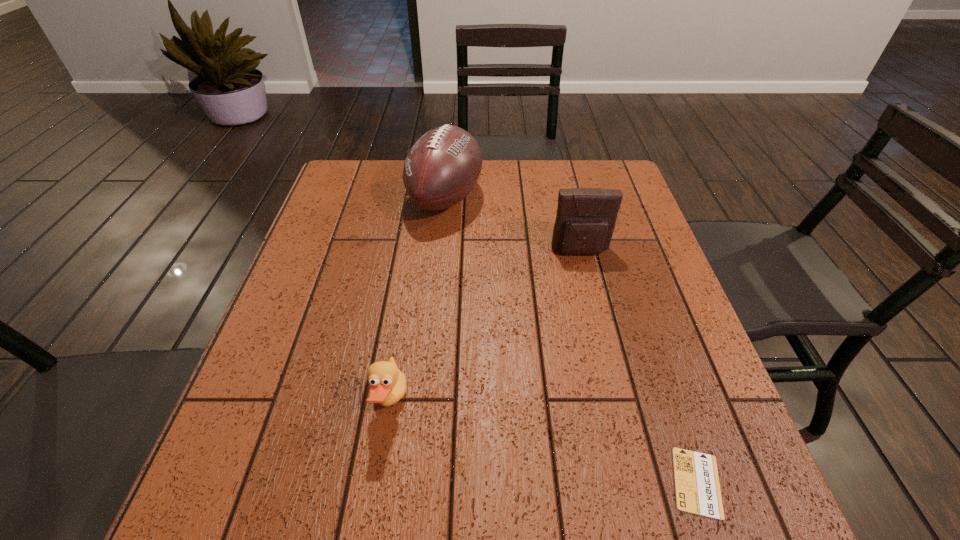
I want to click on football (American), so click(443, 166).

Where is `the tallest object`? The height and width of the screenshot is (540, 960). the tallest object is located at coordinates (443, 166).

Identify the location of pouch. (586, 217).

At what (x,y) coordinates should I click in order to perform the action: click on the third shortest object. Please return your answer as a coordinate pair (x, y). Looking at the image, I should click on (586, 217).

In order to click on the second shortest object in this screenshot , I will do `click(388, 384)`.

At what (x,y) coordinates should I click in order to perform the action: click on duck. Please return your answer as a coordinate pair (x, y). The height and width of the screenshot is (540, 960). Looking at the image, I should click on (388, 384).

The image size is (960, 540). What are the coordinates of `the shortest object` in the screenshot? It's located at pyautogui.click(x=697, y=486).

At what (x,y) coordinates should I click in order to perform the action: click on the nearest object. Please return your answer as a coordinate pair (x, y). This screenshot has height=540, width=960. Looking at the image, I should click on (697, 486).

What are the coordinates of `vacant space located on the right of the farthest object` in the screenshot? It's located at (550, 198).

Find the location of a particular element. The width and height of the screenshot is (960, 540). free spot located with an open flap on the third nearest object is located at coordinates (603, 343).